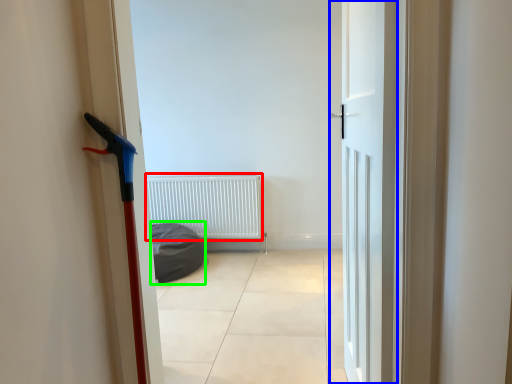
Question: Which object is the closest to the radiator (highlighted by a red box)? Choose among these: door (highlighted by a blue box) or sleeping bag (highlighted by a green box).

Choices:
 (A) door
 (B) sleeping bag

Answer: (B)